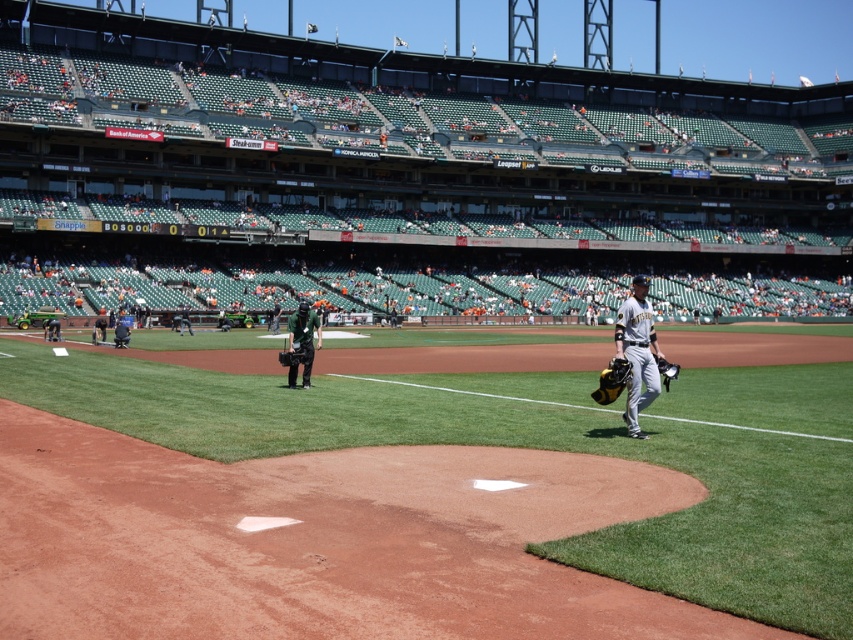
Question: Observing the image, what is the correct spatial positioning of gray uniformed baseball player at center in reference to black uniform at center?

Choices:
 (A) above
 (B) below

Answer: (B)

Question: Which point appears farthest from the camera in this image?

Choices:
 (A) (288, 372)
 (B) (289, 355)
 (C) (608, 378)

Answer: (A)

Question: Is green fabric camera at center smaller than dark gray uniform at center?

Choices:
 (A) no
 (B) yes

Answer: (A)

Question: Can you confirm if dark gray uniform at center is bigger than black uniform at center?

Choices:
 (A) no
 (B) yes

Answer: (A)

Question: Which point is farther to the camera?

Choices:
 (A) black uniform at center
 (B) dark gray uniform at center
 (C) dark gray leather glove at center
 (D) gray uniformed baseball player at center

Answer: (A)

Question: Among these objects, which one is farthest from the camera?

Choices:
 (A) dark gray uniform at center
 (B) gray matte uniform at center

Answer: (B)